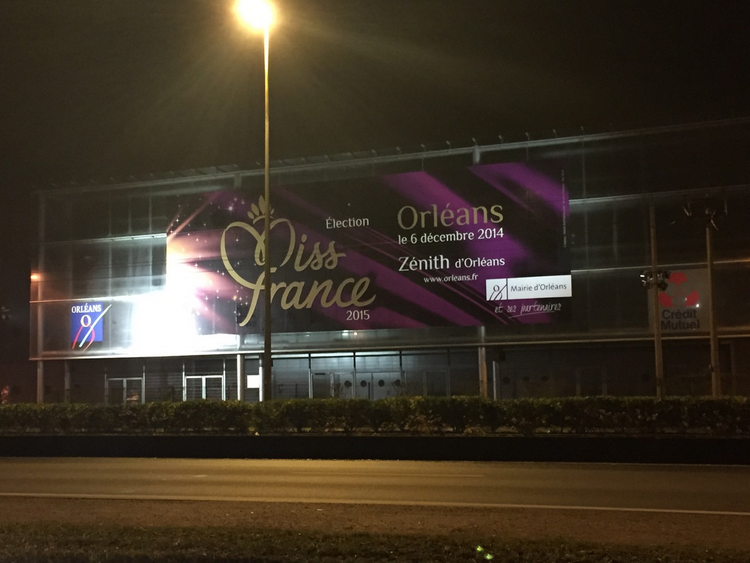
Identify the location of light. (265, 21).